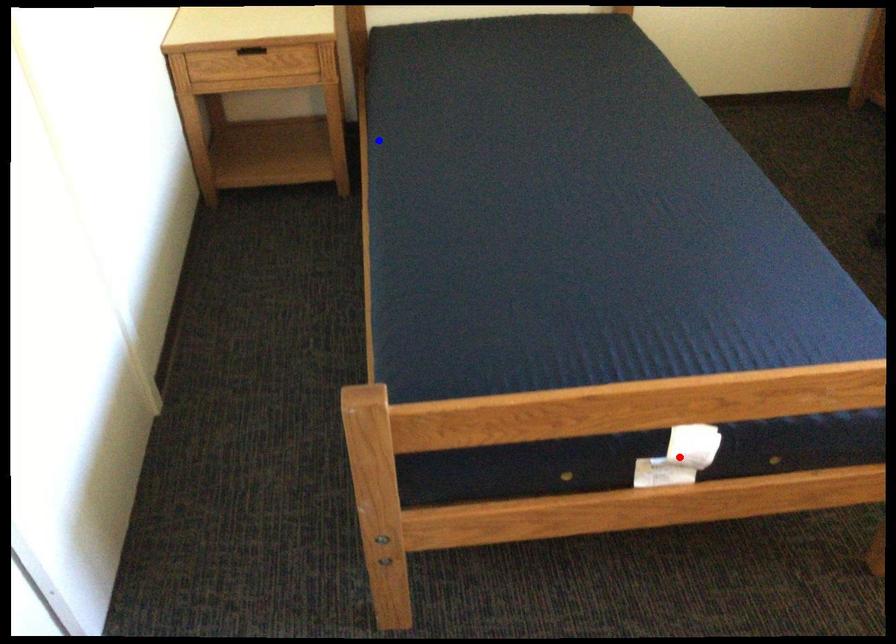
Question: Which of the two points in the image is closer to the camera?

Choices:
 (A) Blue point is closer.
 (B) Red point is closer.

Answer: (B)